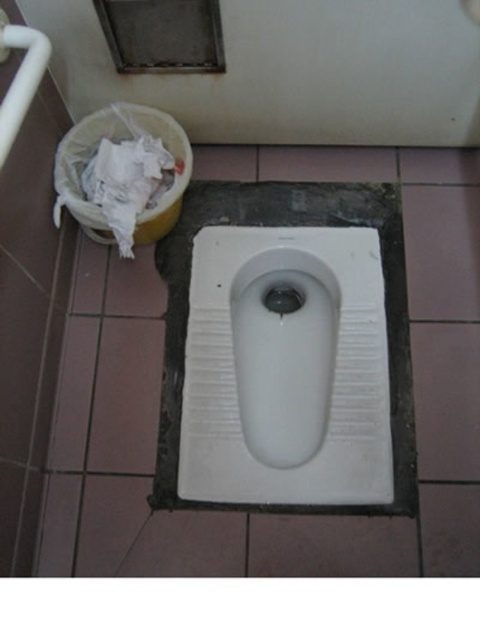
You are a maintenance worker inspecting the bathroom. You notice the white ceramic urinal at center and the white crumpled paper at upper left. Which object is taller?

The white ceramic urinal at center is taller than the white crumpled paper at upper left.

You are standing in the bathroom and need to dispose of a small piece of paper. You see the white ceramic urinal at center and the small yellow plastic bucket with a white plastic bag to its left. Which object should you use for disposal?

You should use the small yellow plastic bucket with a white plastic bag to its left for disposal, as the white ceramic urinal at center is meant for liquid waste and the bucket with the bag is indicated for solid waste like paper.

You are standing in the bathroom and need to place a new item between the two points marked as point (x=236, y=460) and point (x=144, y=141). Which point should you place it closer to so that it remains in front of the other point?

You should place the new item closer to point (x=236, y=460) so that it remains in front of point (x=144, y=141) since point (x=236, y=460) is already in front of point (x=144, y=141).